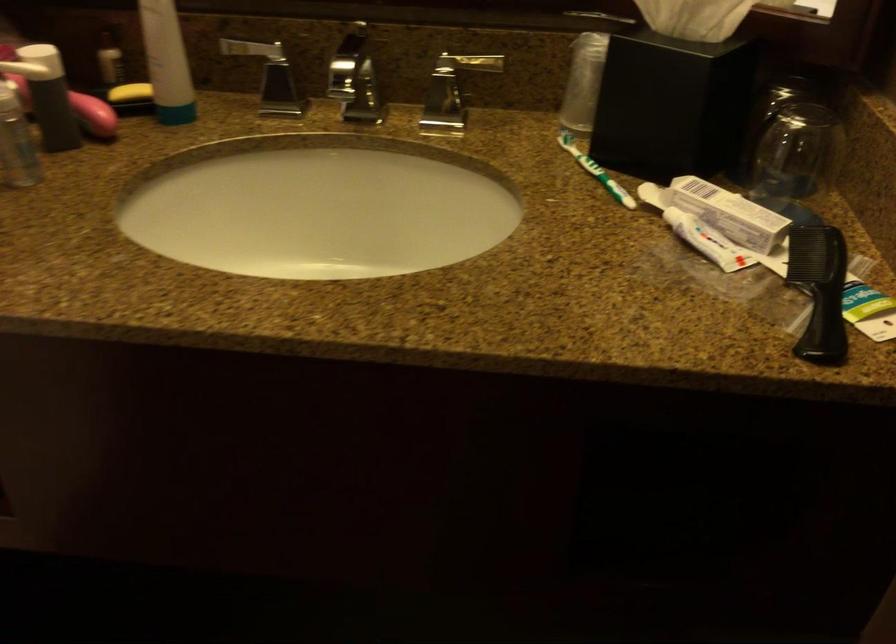
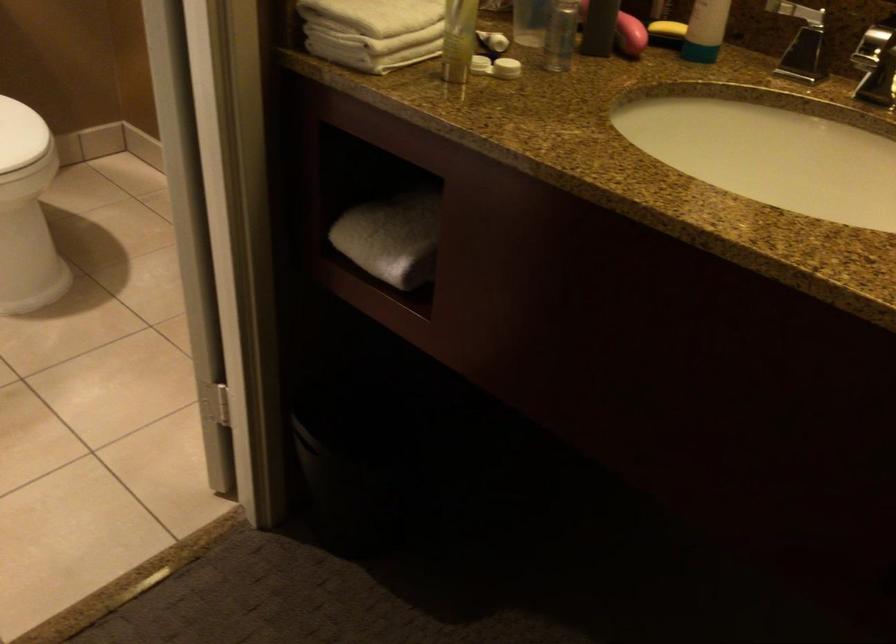
In the second image, find the point that corresponds to (131,93) in the first image.

(667, 29)